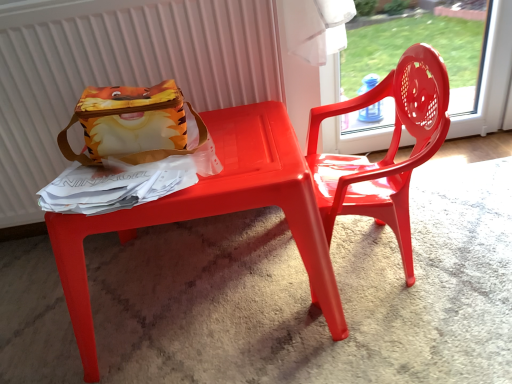
Question: Should I look upward or downward to see glossy plastic chair at right?

Choices:
 (A) up
 (B) down

Answer: (A)

Question: Can you confirm if matte plastic table at center is shorter than glossy plastic chair at right?

Choices:
 (A) no
 (B) yes

Answer: (B)

Question: Is glossy plastic chair at right a part of matte plastic table at center?

Choices:
 (A) no
 (B) yes

Answer: (A)

Question: Is glossy plastic chair at right at the back of matte plastic table at center?

Choices:
 (A) yes
 (B) no

Answer: (B)

Question: From the image's perspective, does matte plastic table at center appear lower than glossy plastic chair at right?

Choices:
 (A) no
 (B) yes

Answer: (B)

Question: Considering the relative sizes of matte plastic table at center and glossy plastic chair at right in the image provided, is matte plastic table at center smaller than glossy plastic chair at right?

Choices:
 (A) yes
 (B) no

Answer: (B)

Question: Is matte plastic table at center wider than glossy plastic chair at right?

Choices:
 (A) no
 (B) yes

Answer: (B)

Question: Is matte plastic radiator at upper left taller than matte fabric lunchbox at upper left?

Choices:
 (A) yes
 (B) no

Answer: (A)

Question: Is matte plastic radiator at upper left at the right side of matte fabric lunchbox at upper left?

Choices:
 (A) yes
 (B) no

Answer: (B)

Question: Is matte plastic radiator at upper left further to camera compared to matte fabric lunchbox at upper left?

Choices:
 (A) yes
 (B) no

Answer: (A)

Question: Is matte plastic radiator at upper left with matte fabric lunchbox at upper left?

Choices:
 (A) yes
 (B) no

Answer: (B)

Question: From the image's perspective, is matte plastic radiator at upper left located above matte fabric lunchbox at upper left?

Choices:
 (A) no
 (B) yes

Answer: (B)

Question: From a real-world perspective, is matte plastic radiator at upper left below matte fabric lunchbox at upper left?

Choices:
 (A) no
 (B) yes

Answer: (B)

Question: Would you say matte fabric lunchbox at upper left is a long distance from matte plastic radiator at upper left?

Choices:
 (A) no
 (B) yes

Answer: (A)